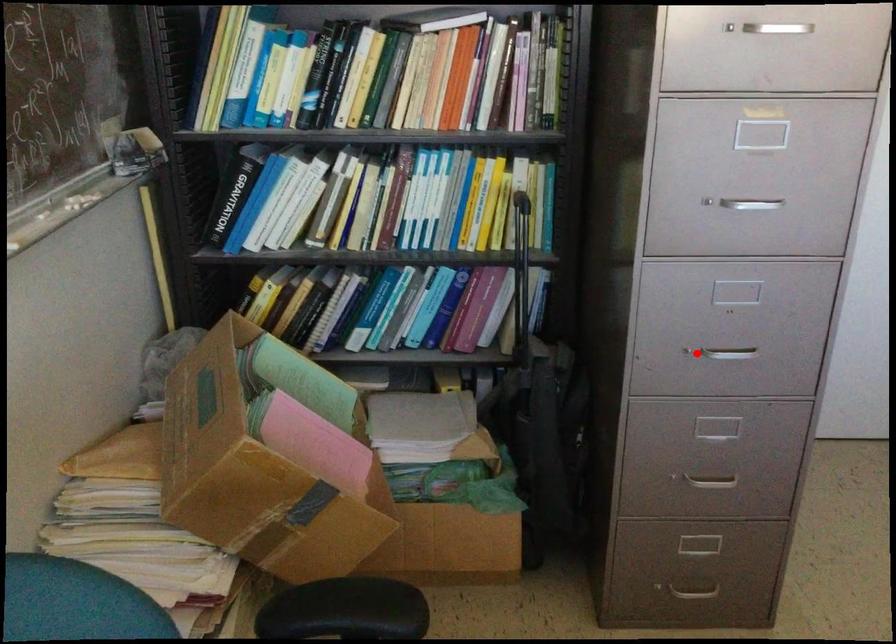
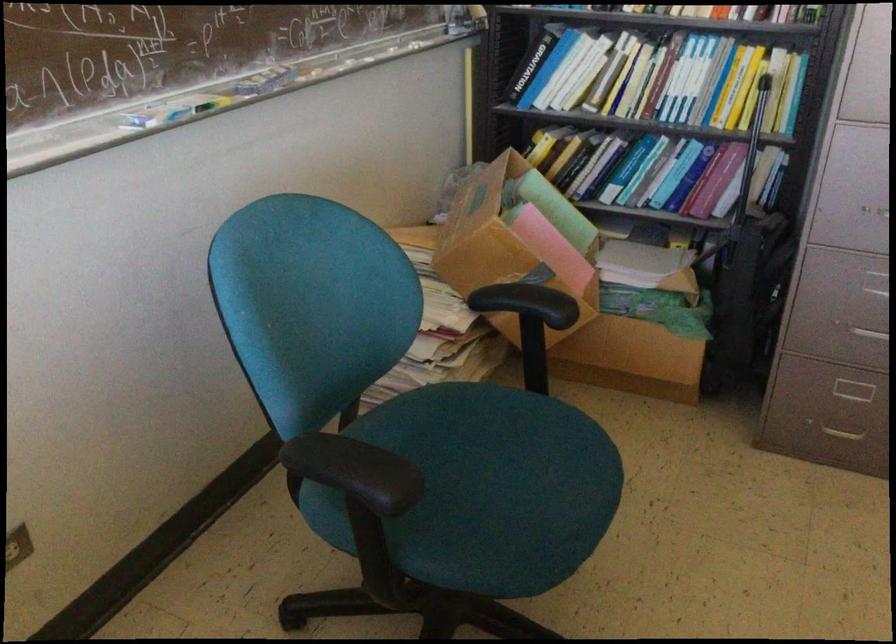
Find the pixel in the second image that matches the highlighted location in the first image.

(877, 214)